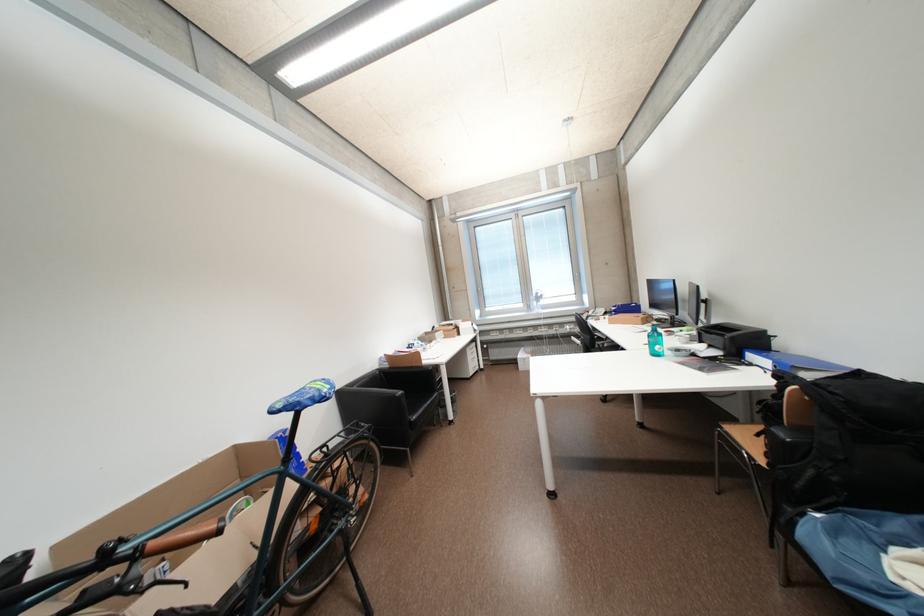
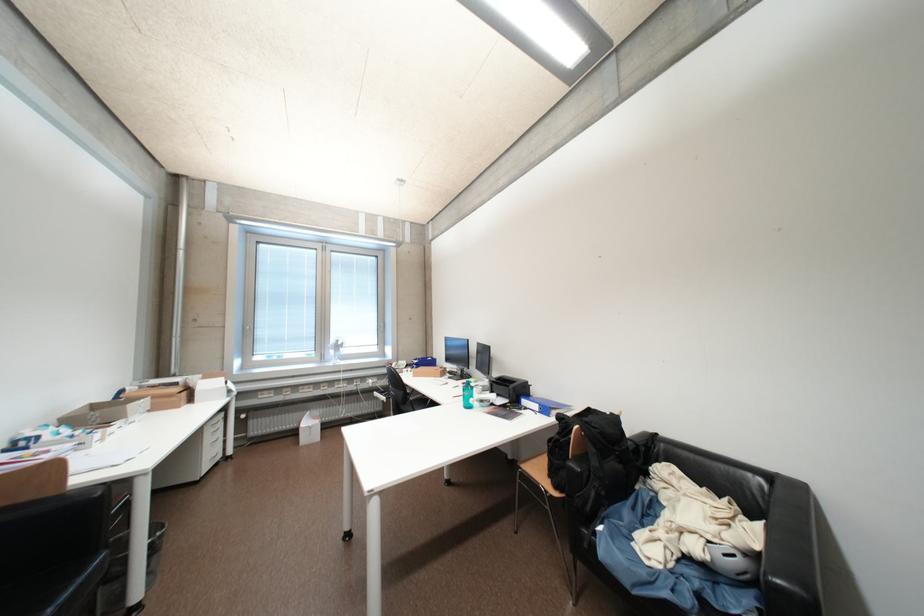
Where in the second image is the point corresponding to point 542,305 from the first image?

(339, 354)